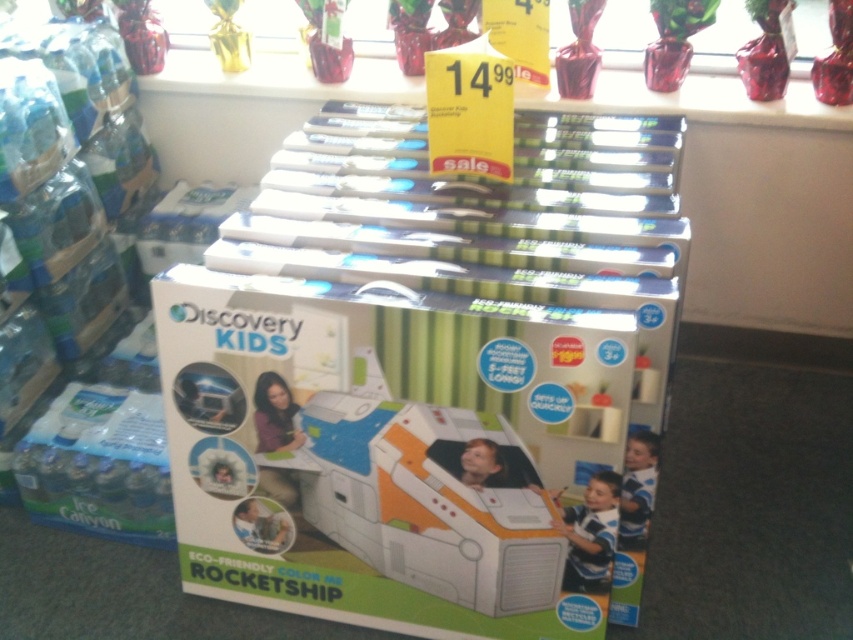
Is point (581, 56) positioned after point (657, 42)?

No, it is not.

Identify the location of shiny red glass vase at upper center. Image resolution: width=853 pixels, height=640 pixels. (579, 51).

Locate an element on the screen. white cardboard box at center is located at coordinates (386, 449).

Is white cardboard box at center to the right of transparent glass vase at upper center from the viewer's perspective?

Incorrect, white cardboard box at center is not on the right side of transparent glass vase at upper center.

Who is more forward, (341, 394) or (672, 42)?

Point (341, 394) is in front.

Identify the location of white cardboard box at center. (386, 449).

Who is taller, glassy clear vase at upper center or transparent glass vase at upper center?

glassy clear vase at upper center is taller.

Based on the photo, which is more to the right, glassy clear vase at upper center or transparent glass vase at upper center?

From the viewer's perspective, transparent glass vase at upper center appears more on the right side.

Which is in front, point (173, 58) or point (682, 83)?

Point (682, 83) is more forward.

Find the location of `glassy clear vase at upper center`. glassy clear vase at upper center is located at coordinates (692, 100).